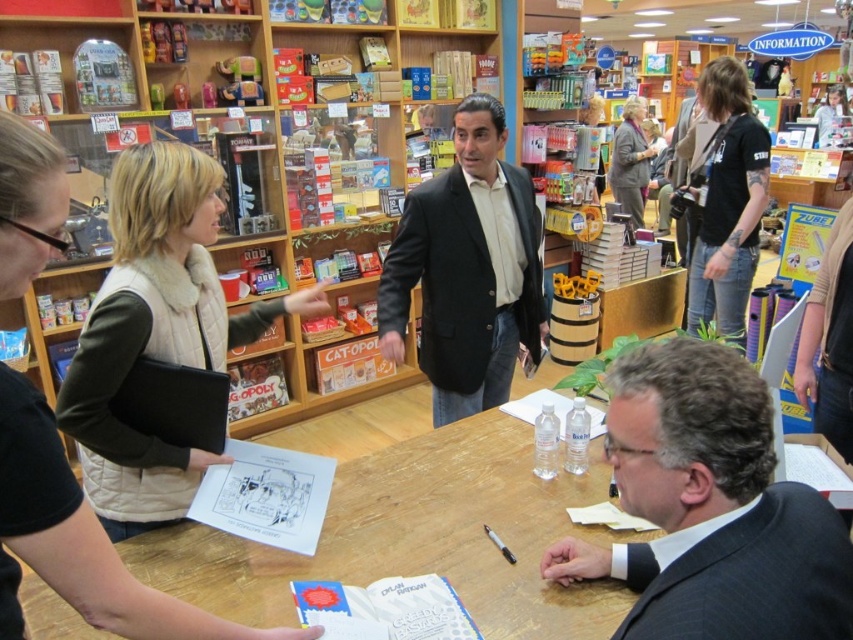
Who is shorter, beige quilted vest at upper left or matte gray blazer at upper right?

With less height is beige quilted vest at upper left.

Between point (148, 508) and point (639, 204), which one is positioned behind?

The point (639, 204) is behind.

Which is behind, point (125, 371) or point (633, 202)?

The point (633, 202) is behind.

The width and height of the screenshot is (853, 640). I want to click on beige quilted vest at upper left, so click(x=155, y=332).

Is wooden table at center above matte gray blazer at upper right?

Actually, wooden table at center is below matte gray blazer at upper right.

Who is shorter, wooden table at center or matte gray blazer at upper right?

With less height is wooden table at center.

Is point (270, 589) positioned after point (624, 193)?

That is False.

Find the location of a particular element. The height and width of the screenshot is (640, 853). wooden table at center is located at coordinates (415, 536).

Which is in front, point (137, 92) or point (460, 211)?

Point (460, 211)

Does point (9, 29) lie behind point (442, 256)?

Yes, point (9, 29) is farther from viewer.

Locate an element on the screen. Image resolution: width=853 pixels, height=640 pixels. wooden bookshelf at center is located at coordinates (326, 118).